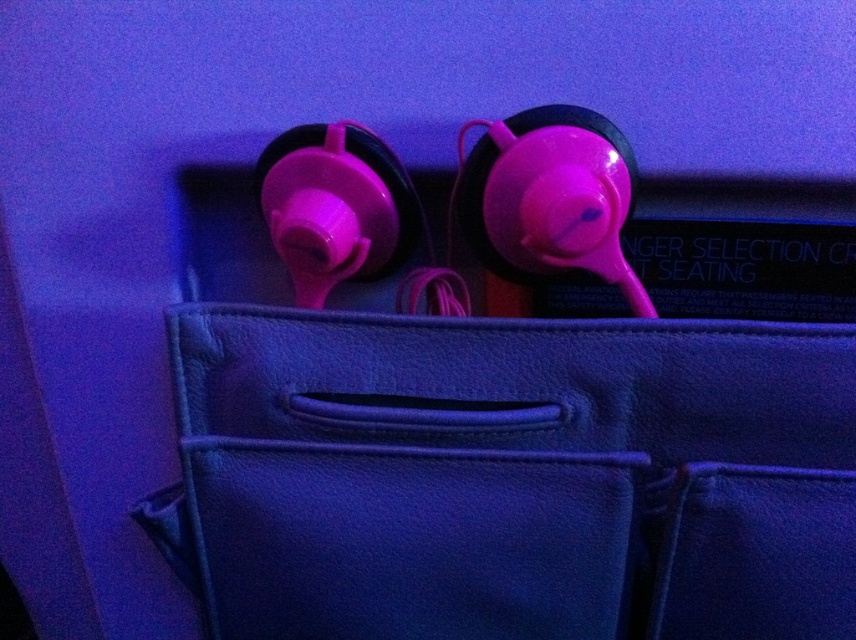
Between leather bag at center and pink matte earphone at center, which one is positioned lower?

leather bag at center

Who is more forward, (257, 541) or (536, 234)?

Point (536, 234)

You are a GUI agent. You are given a task and a screenshot of the screen. Output one action in this format:
    pyautogui.click(x=<x>, y=<y>)
    Task: Click on the leather bag at center
    The height and width of the screenshot is (640, 856).
    Given the screenshot: What is the action you would take?
    pyautogui.click(x=510, y=476)

What do you see at coordinates (550, 196) in the screenshot? I see `pink matte earphone at center` at bounding box center [550, 196].

Who is shorter, pink matte earphone at center or matte pink earphone at upper center?

With less height is matte pink earphone at upper center.

Who is more distant from viewer, [503,260] or [312,212]?

Positioned behind is point [503,260].

Find the location of a particular element. pink matte earphone at center is located at coordinates (550, 196).

Does point (348, 612) come closer to viewer compared to point (401, 205)?

No, it is behind (401, 205).

Is point (474, 596) positioned after point (318, 180)?

Yes, it is behind point (318, 180).

Is point (413, 330) in front of point (321, 150)?

No.

What are the coordinates of `leather bag at center` in the screenshot? It's located at (510, 476).